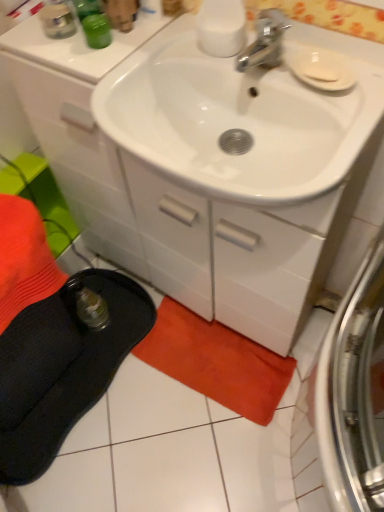
Question: Considering their positions, is white matte soap at upper right located in front of or behind orange cotton beach towel at lower center?

Choices:
 (A) behind
 (B) front

Answer: (B)

Question: From the image's perspective, is white matte soap at upper right above or below orange cotton beach towel at lower center?

Choices:
 (A) below
 (B) above

Answer: (B)

Question: Estimate the real-world distances between objects in this image. Which object is closer to the white glossy cabinet at center?

Choices:
 (A) white matte soap at upper right
 (B) black fabric slipper at lower left
 (C) orange cotton beach towel at lower center

Answer: (A)

Question: Considering the real-world distances, which object is closest to the orange cotton beach towel at lower center?

Choices:
 (A) white glossy cabinet at center
 (B) white matte soap at upper right
 (C) black fabric slipper at lower left

Answer: (C)